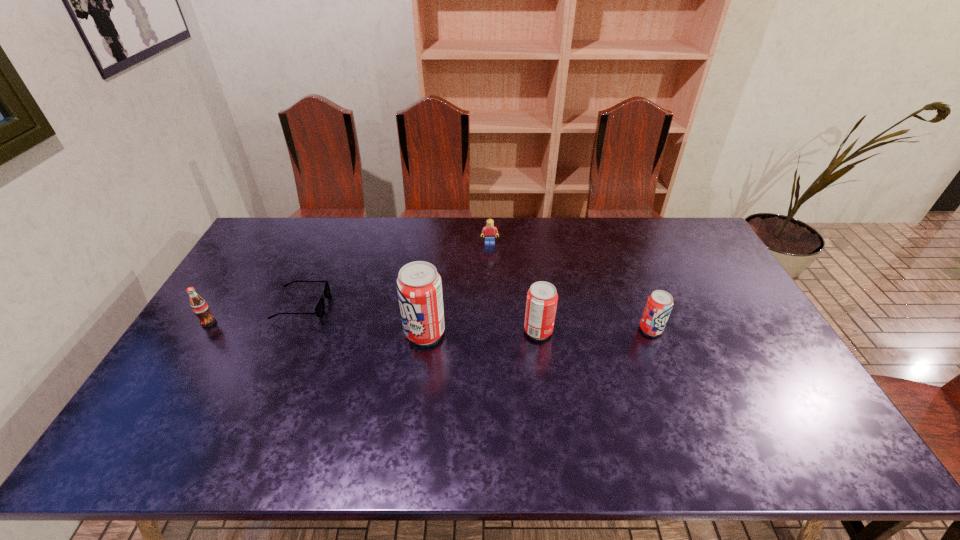
Locate an element on the screen. Image resolution: width=960 pixels, height=540 pixels. free spot that satisfies the following two spatial constraints: 1. on the back side of the second object from right to left; 2. on the left side of the rightmost object is located at coordinates (538, 329).

Find the location of a particular element. The height and width of the screenshot is (540, 960). vacant area in the image that satisfies the following two spatial constraints: 1. on the front-facing side of the Lego; 2. on the front-facing side of the spectacles is located at coordinates (492, 305).

Locate an element on the screen. Image resolution: width=960 pixels, height=540 pixels. vacant space that satisfies the following two spatial constraints: 1. on the front-facing side of the rightmost object; 2. on the right side of the farthest object is located at coordinates (492, 329).